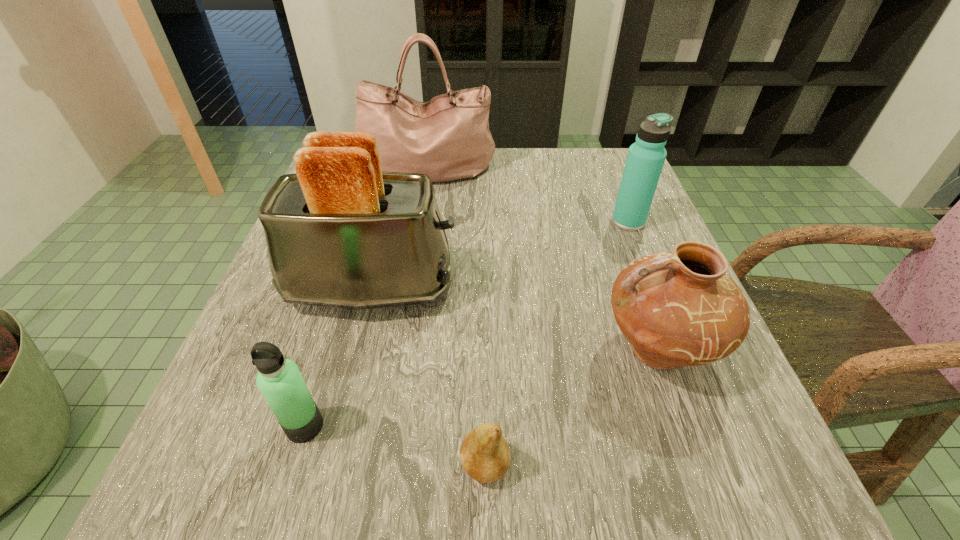
This screenshot has height=540, width=960. What are the coordinates of `free spot located 0.240m on the front of the farther thermos bottle` in the screenshot? It's located at (667, 320).

Identify the location of free space located 0.190m on the side of the pottery with the handle. Image resolution: width=960 pixels, height=540 pixels. (479, 349).

Image resolution: width=960 pixels, height=540 pixels. Identify the location of vacant area located 0.220m on the side of the pottery with the handle. (460, 349).

Locate an element on the screen. free region located 0.140m on the side of the pottery with the handle is located at coordinates (511, 349).

Find the location of `free spot located 0.130m on the right of the nearer thermos bottle`. free spot located 0.130m on the right of the nearer thermos bottle is located at coordinates (418, 426).

In order to click on free location located 0.110m on the right of the pear in this screenshot , I will do `click(595, 465)`.

Locate an element on the screen. This screenshot has width=960, height=540. object positioned at the far edge is located at coordinates (447, 138).

Find the location of a particular element. The width and height of the screenshot is (960, 540). thermos bottle present at the near edge is located at coordinates (279, 380).

You are a GUI agent. You are given a task and a screenshot of the screen. Output one action in this format:
    pyautogui.click(x=<x>, y=<y>)
    Task: Click on the pear situated at the near edge
    The height and width of the screenshot is (540, 960).
    Given the screenshot: What is the action you would take?
    pyautogui.click(x=484, y=454)

You are a GUI agent. You are given a task and a screenshot of the screen. Output one action in this format:
    pyautogui.click(x=<x>, y=<y>)
    Task: Click on the handbag present at the left edge
    This screenshot has width=960, height=540.
    Given the screenshot: What is the action you would take?
    pyautogui.click(x=447, y=138)